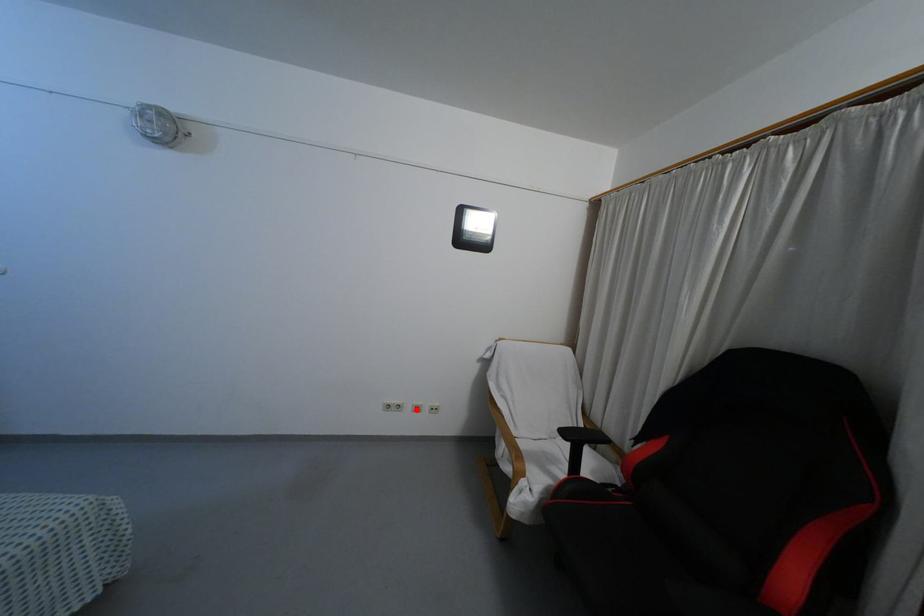
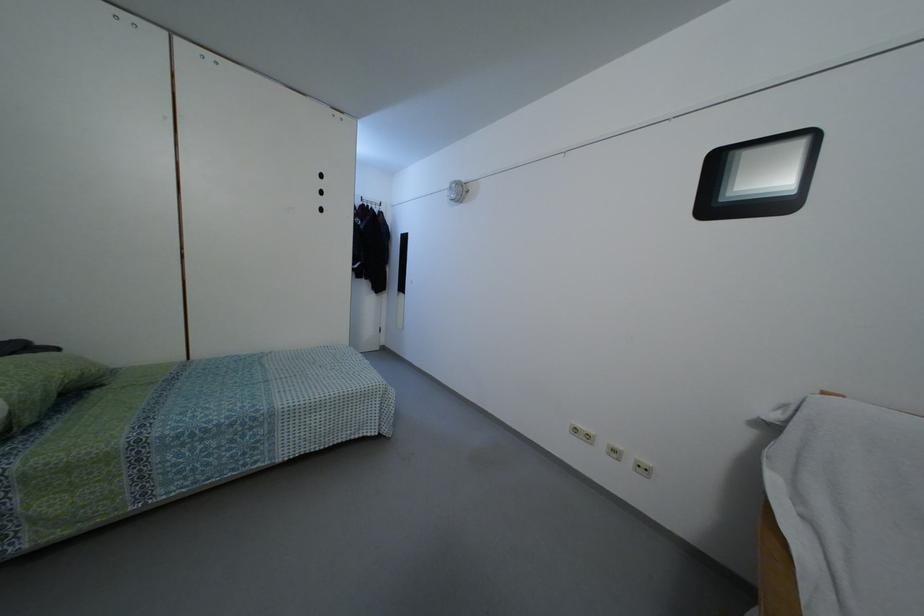
Locate, in the second image, the point that corresponds to the highlighted location in the first image.

(614, 456)